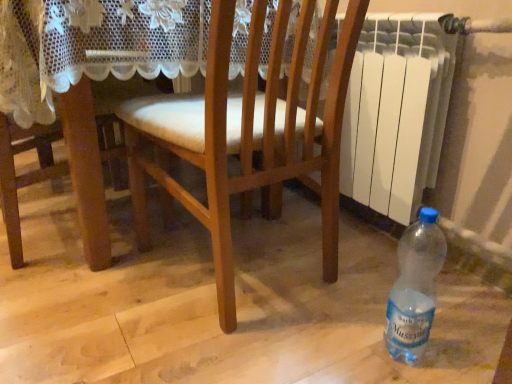
Identify the location of free space behind translucent plastic bottle at lower right. This screenshot has width=512, height=384. (358, 300).